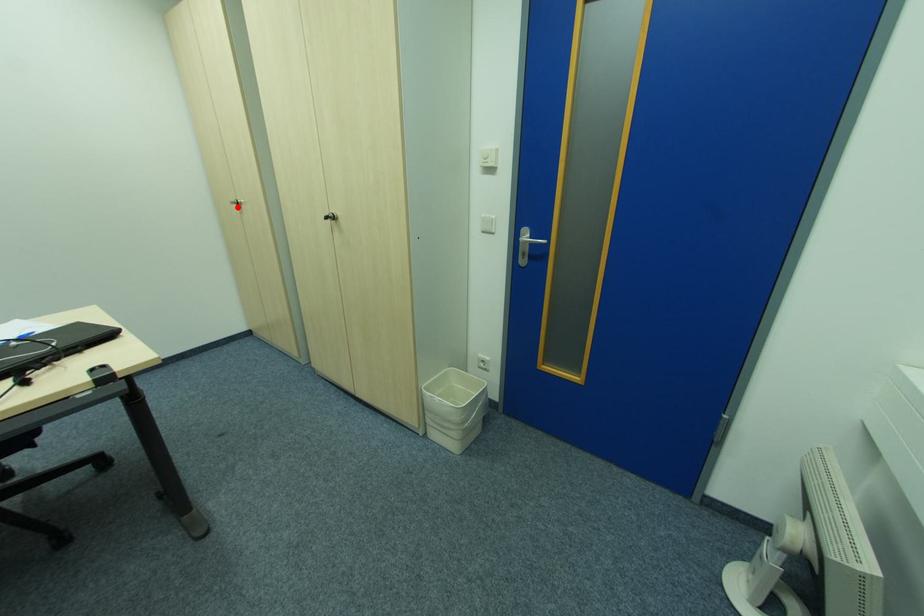
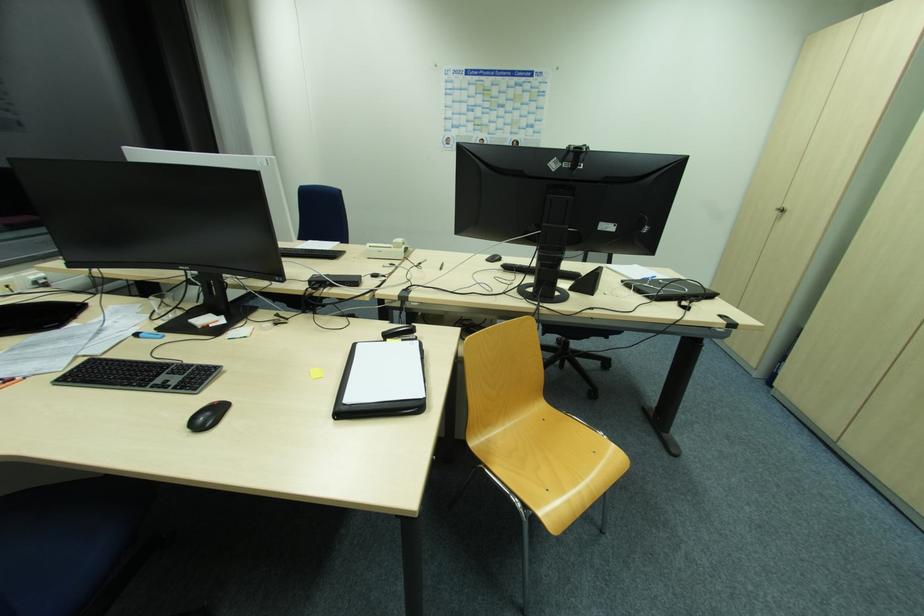
Find the pixel in the second image that matches the highlighted location in the first image.

(779, 214)